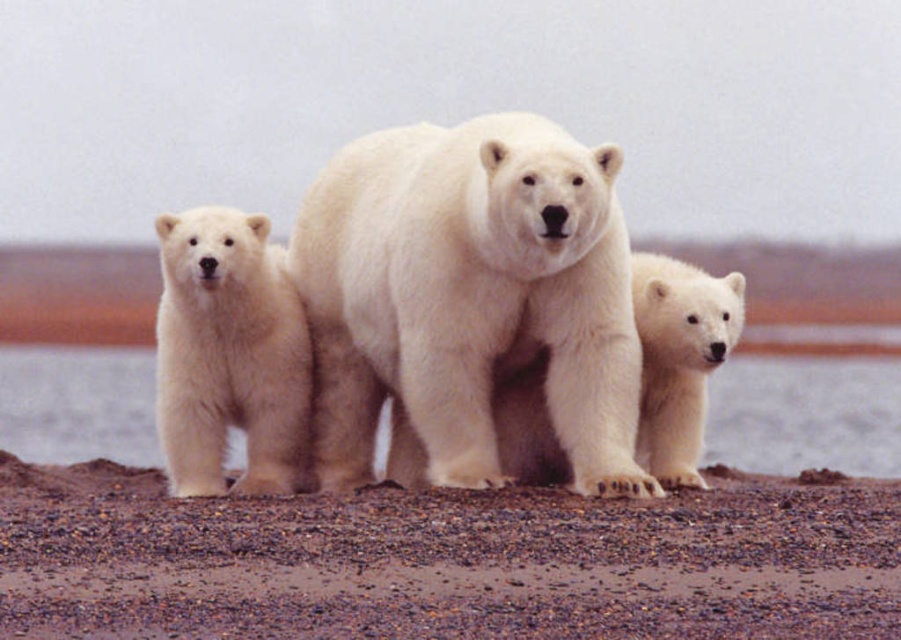
Question: Is white fur water at center bigger than white fluffy polar bear at left?

Choices:
 (A) yes
 (B) no

Answer: (A)

Question: From the image, what is the correct spatial relationship of brown gravel at center in relation to white fluffy bear cub at lower right?

Choices:
 (A) left
 (B) right

Answer: (A)

Question: Can you confirm if white fluffy polar bear at left is positioned above white fluffy bear cub at lower right?

Choices:
 (A) no
 (B) yes

Answer: (B)

Question: Considering the real-world distances, which object is farthest from the white fluffy polar bear at left?

Choices:
 (A) white fluffy bear cub at lower right
 (B) brown gravel at center
 (C) white fur polar bear at center

Answer: (B)

Question: Which of these objects is positioned farthest from the white fluffy polar bear at left?

Choices:
 (A) white fluffy bear cub at lower right
 (B) white fur polar bear at center
 (C) brown gravel at center
 (D) white fur water at center

Answer: (C)

Question: Which point is closer to the camera?

Choices:
 (A) (202, 291)
 (B) (149, 449)
 (C) (713, 308)
 (D) (567, 244)

Answer: (D)